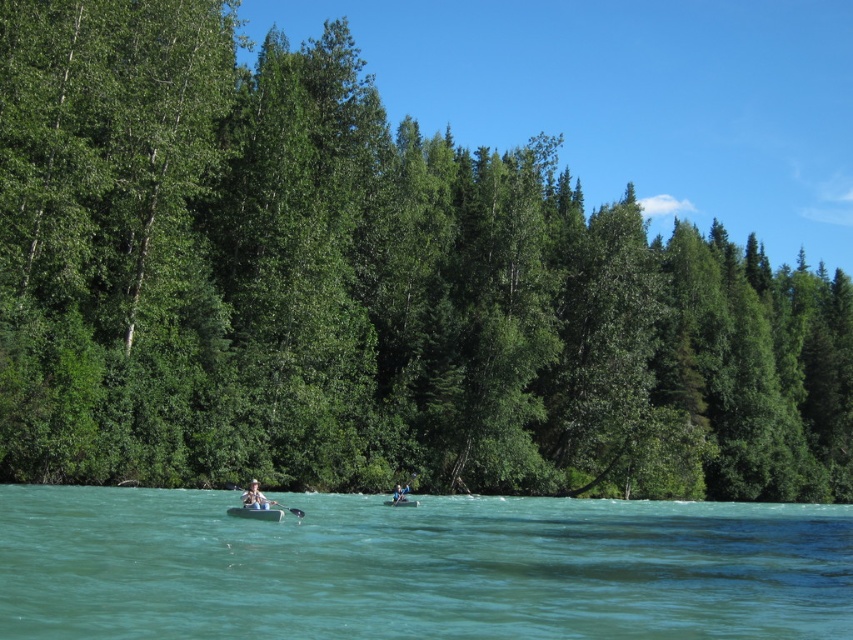
You are planning to store a light brown wooden paddle at center and a green rubber boat at center in a storage compartment. The compartment can only fit one item at a time. Which item should you store first if you want to maximize the space used?

The green rubber boat at center is wider than the light brown wooden paddle at center, so you should store the green rubber boat at center first to utilize the compartment space more efficiently.

You are planning to take a photo of the clear turquoise water at center and the light brown wooden paddleboard at center from the riverbank. Which object will appear larger in the photo?

The clear turquoise water at center will appear larger in the photo because it is much taller than the light brown wooden paddleboard at center.